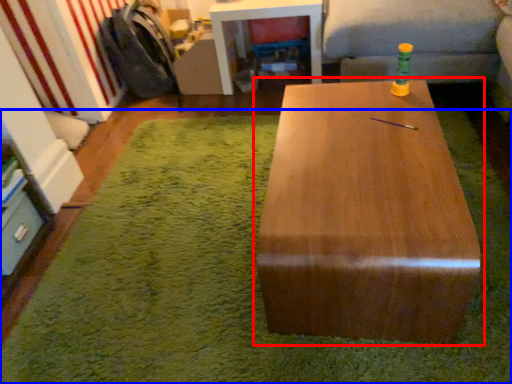
Question: Which object appears farthest to the camera in this image, table (highlighted by a red box) or mat (highlighted by a blue box)?

Choices:
 (A) table
 (B) mat

Answer: (B)